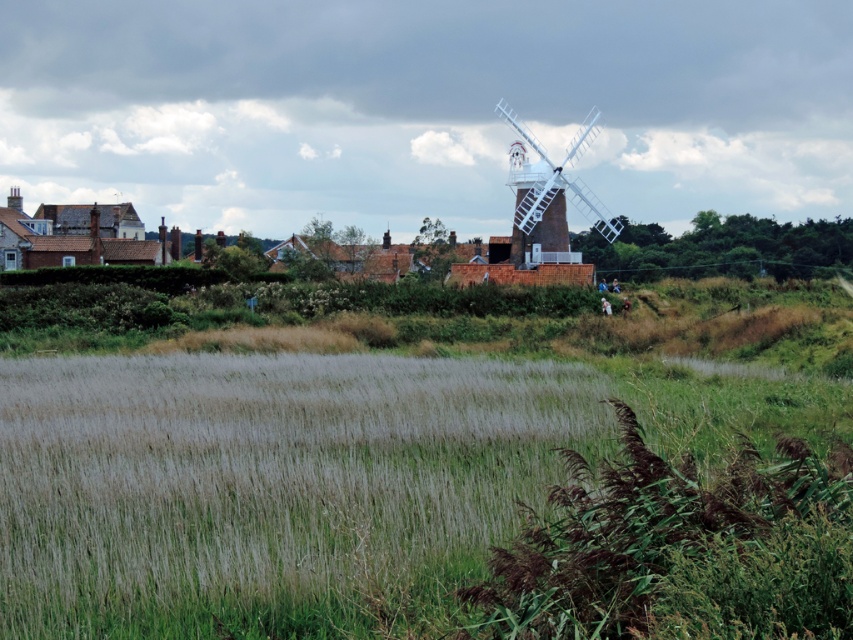
You are standing at the base of the windmill and want to walk to a specific location in the field of tall grasses. You have two points to choose from, point (769,572) and point (521,252). Which point is closer to you?

Point (769,572) is in front of point (521,252), so it is closer to you.

You are standing in the countryside and see the green grassy rice field at lower left and the white wooden windmill at center. Which object is taller?

The white wooden windmill at center is taller than the green grassy rice field at lower left.

You are standing in the countryside scene looking at the windmill and the surrounding buildings. There are two points marked in the image. Which point is closer to you, point (x=91, y=534) or point (x=816, y=602)?

Point (x=91, y=534) is closer to you because it is further to the viewer than point (x=816, y=602).